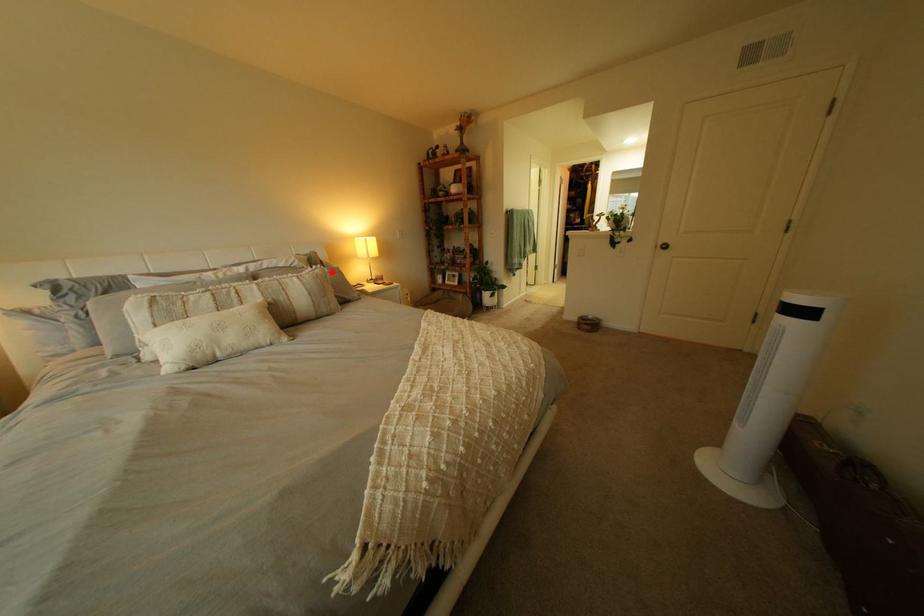
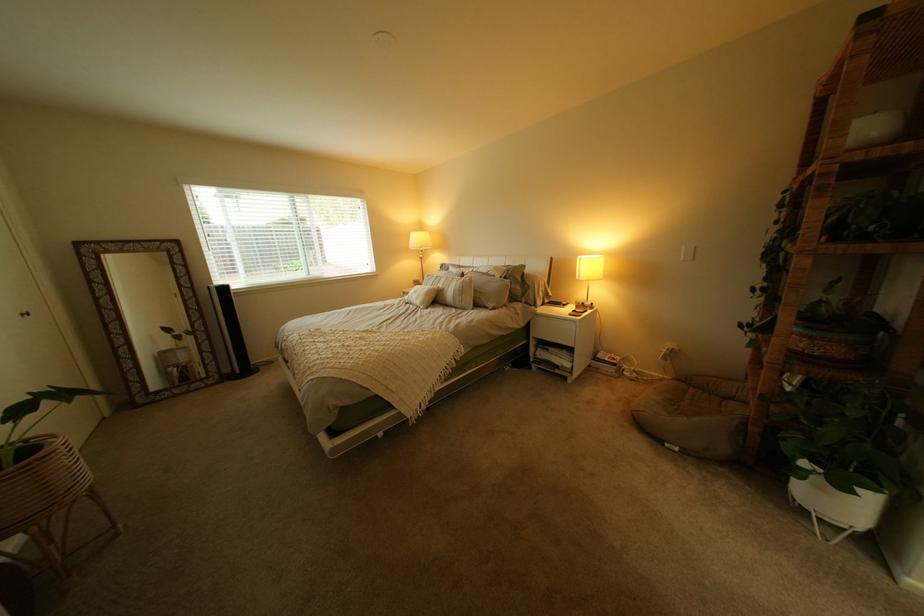
Locate, in the second image, the point that corresponds to the highlighted location in the first image.

(482, 280)